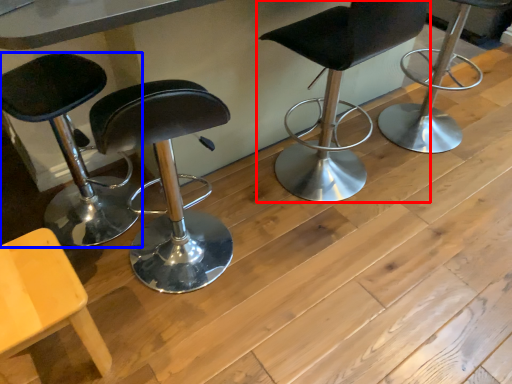
Question: Among these objects, which one is farthest to the camera, chair (highlighted by a red box) or chair (highlighted by a blue box)?

Choices:
 (A) chair
 (B) chair

Answer: (A)